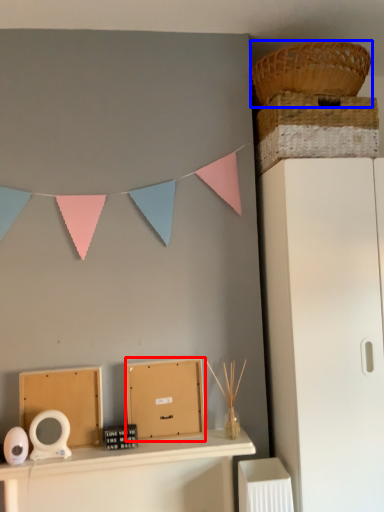
Question: Which object appears closest to the camera in this image, cardboard box (highlighted by a red box) or basket (highlighted by a blue box)?

Choices:
 (A) cardboard box
 (B) basket

Answer: (B)